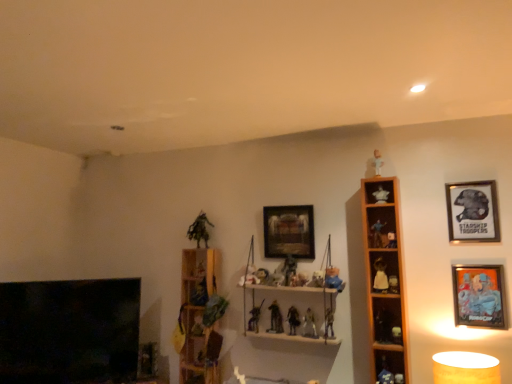
Question: Which direction should I rotate to look at matte plastic toy at center, arranged as the twentieth toy when viewed from the left?

Choices:
 (A) left
 (B) right

Answer: (B)

Question: From a real-world perspective, is black glass fireplace at lower left located beneath matte plastic figurine at center, the 2th toy viewed from the left?

Choices:
 (A) yes
 (B) no

Answer: (A)

Question: Is the position of black glass fireplace at lower left more distant than that of matte plastic figurine at center, the 2th toy viewed from the left?

Choices:
 (A) yes
 (B) no

Answer: (B)

Question: From a real-world perspective, is black glass fireplace at lower left located higher than matte plastic figurine at center, the 2th toy viewed from the left?

Choices:
 (A) no
 (B) yes

Answer: (A)

Question: Can we say black glass fireplace at lower left lies outside matte plastic figurine at center, the 2th toy viewed from the left?

Choices:
 (A) yes
 (B) no

Answer: (A)

Question: Does black glass fireplace at lower left have a greater width compared to matte plastic figurine at center, the 2th toy viewed from the left?

Choices:
 (A) no
 (B) yes

Answer: (A)

Question: Considering the relative sizes of black glass fireplace at lower left and matte plastic figurine at center, the 2th toy viewed from the left, in the image provided, is black glass fireplace at lower left shorter than matte plastic figurine at center, the 2th toy viewed from the left,?

Choices:
 (A) yes
 (B) no

Answer: (B)

Question: Does matte plastic figurine at center, the 2th toy viewed from the left, have a smaller size compared to matte plastic action figure at center, acting as the eleventh toy starting from the right?

Choices:
 (A) yes
 (B) no

Answer: (B)

Question: Can we say matte plastic figurine at center, which is counted as the 19th toy, starting from the right, lies outside matte plastic action figure at center, positioned as the 10th toy in left-to-right order?

Choices:
 (A) no
 (B) yes

Answer: (B)

Question: Is matte plastic figurine at center, which is counted as the 19th toy, starting from the right, oriented away from matte plastic action figure at center, positioned as the 10th toy in left-to-right order?

Choices:
 (A) no
 (B) yes

Answer: (A)

Question: Can you confirm if matte plastic figurine at center, the 2th toy viewed from the left, is shorter than matte plastic action figure at center, acting as the eleventh toy starting from the right?

Choices:
 (A) yes
 (B) no

Answer: (B)

Question: Does matte plastic figurine at center, the 2th toy viewed from the left, appear on the left side of matte plastic action figure at center, positioned as the 10th toy in left-to-right order?

Choices:
 (A) yes
 (B) no

Answer: (A)

Question: Does matte plastic figurine at center, which is counted as the 19th toy, starting from the right, turn towards matte plastic action figure at center, acting as the eleventh toy starting from the right?

Choices:
 (A) yes
 (B) no

Answer: (B)

Question: Is metallic silver figure at center, arranged as the 8th toy when viewed from the left, shorter than matte gold table lamp at lower right?

Choices:
 (A) yes
 (B) no

Answer: (A)